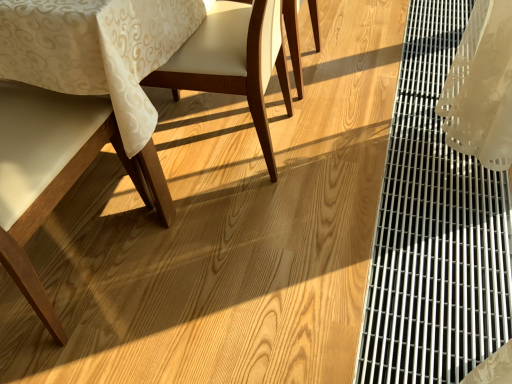
The height and width of the screenshot is (384, 512). Identify the location of vacant area situated to the left side of metallic grid at right. (318, 152).